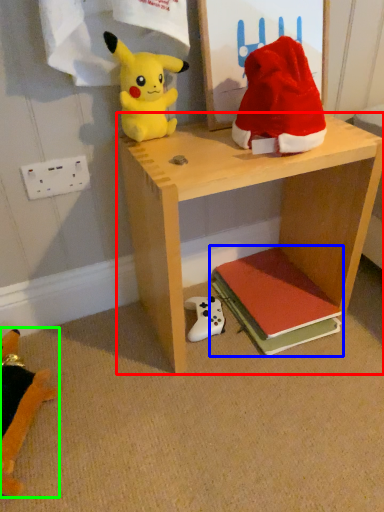
Question: Considering the real-world distances, which object is closest to shelf (highlighted by a red box)? book (highlighted by a blue box) or toy (highlighted by a green box).

Choices:
 (A) book
 (B) toy

Answer: (A)